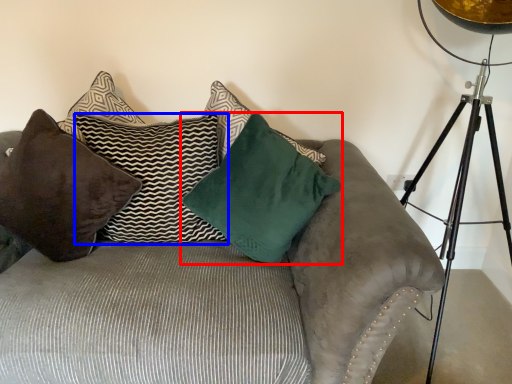
Question: Which object is closer to the camera taking this photo, pillow (highlighted by a red box) or pillow (highlighted by a blue box)?

Choices:
 (A) pillow
 (B) pillow

Answer: (A)